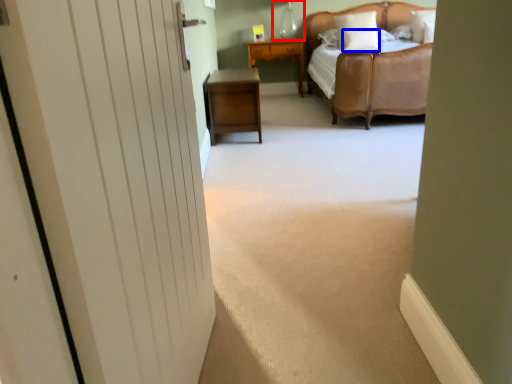
Question: Which object is further to the camera taking this photo, table lamp (highlighted by a red box) or pillow (highlighted by a blue box)?

Choices:
 (A) table lamp
 (B) pillow

Answer: (A)